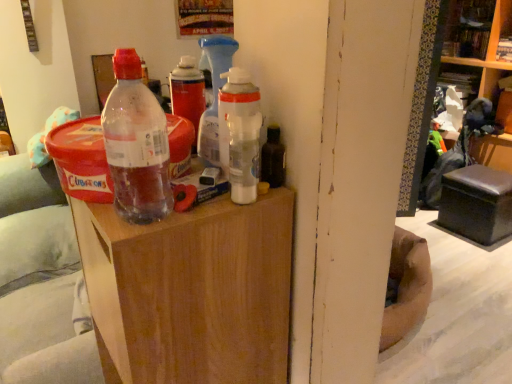
Question: Considering their positions, is translucent plastic bottle at center located in front of or behind wooden bookshelf at upper right, the 1th shelf from the top?

Choices:
 (A) front
 (B) behind

Answer: (A)

Question: Based on their sizes in the image, would you say translucent plastic bottle at center is bigger or smaller than wooden bookshelf at upper right, the 1th shelf from the top?

Choices:
 (A) small
 (B) big

Answer: (A)

Question: Which object is positioned farthest from the wooden bookshelf at upper right, the 1th shelf from the top?

Choices:
 (A) wooden side table at center
 (B) translucent plastic bottle at center
 (C) wooden bookshelf at upper right, acting as the first shelf starting from the bottom

Answer: (A)

Question: Which of these objects is positioned farthest from the wooden bookshelf at upper right, acting as the first shelf starting from the bottom?

Choices:
 (A) wooden side table at center
 (B) translucent plastic bottle at center
 (C) wooden bookshelf at upper right, the second shelf ordered from the bottom

Answer: (B)